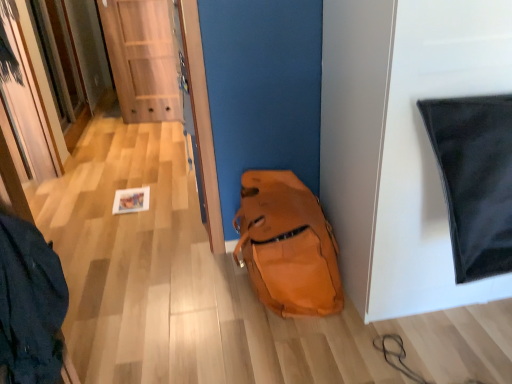
Locate an element on the screen. vacant space in front of wooden door at center is located at coordinates (158, 128).